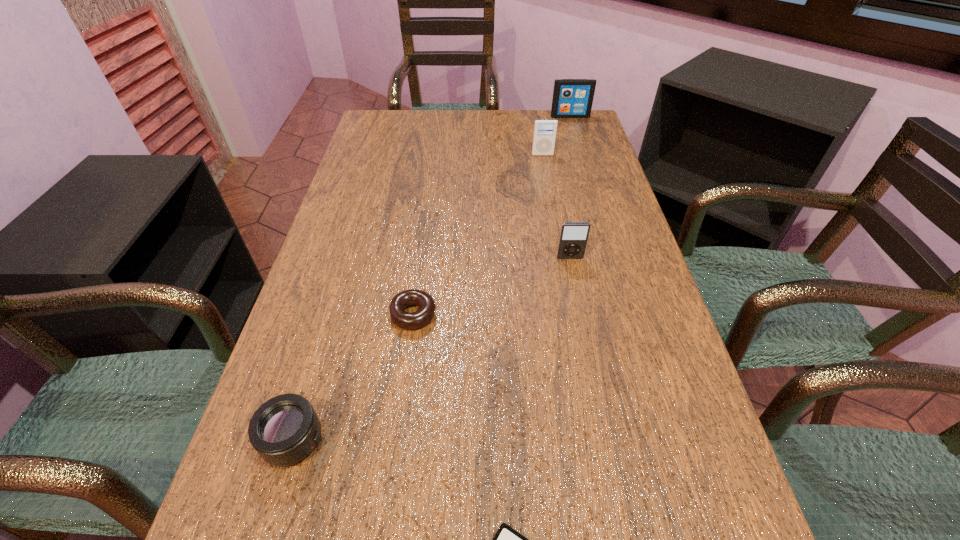
Find the location of a particular element. vacant space at the far right corner of the desktop is located at coordinates (571, 121).

The width and height of the screenshot is (960, 540). Identify the location of vacant area that lies between the telephoto lens and the rightmost object. (x=432, y=278).

The width and height of the screenshot is (960, 540). Identify the location of vacant area between the fifth nearest object and the rightmost object. (556, 136).

Identify the location of free space between the farthest iPod and the second object from left to right. (492, 215).

Where is `vacant space that's between the fifth farthest object and the second object from left to right`? This screenshot has width=960, height=540. vacant space that's between the fifth farthest object and the second object from left to right is located at coordinates (353, 377).

Find the location of a particular element. The height and width of the screenshot is (540, 960). vacant region between the rightmost object and the third nearest iPod is located at coordinates (556, 136).

Locate an element on the screen. This screenshot has width=960, height=540. object that can be found as the second closest to the farthest object is located at coordinates (573, 238).

You are a GUI agent. You are given a task and a screenshot of the screen. Output one action in this format:
    pyautogui.click(x=<x>, y=<y>)
    Task: Click on the third closest object relative to the leftmost iPod
    
    Given the screenshot: What is the action you would take?
    573,238

Image resolution: width=960 pixels, height=540 pixels. I want to click on iPod that is the second closest to the farthest iPod, so click(x=573, y=238).

Identify which iPod is the third closest to the second object from left to right. Please provide its 2D coordinates. Your answer should be formatted as a tuple, i.e. [(x, y)], where the tuple contains the x and y coordinates of a point satisfying the conditions above.

[(544, 136)]